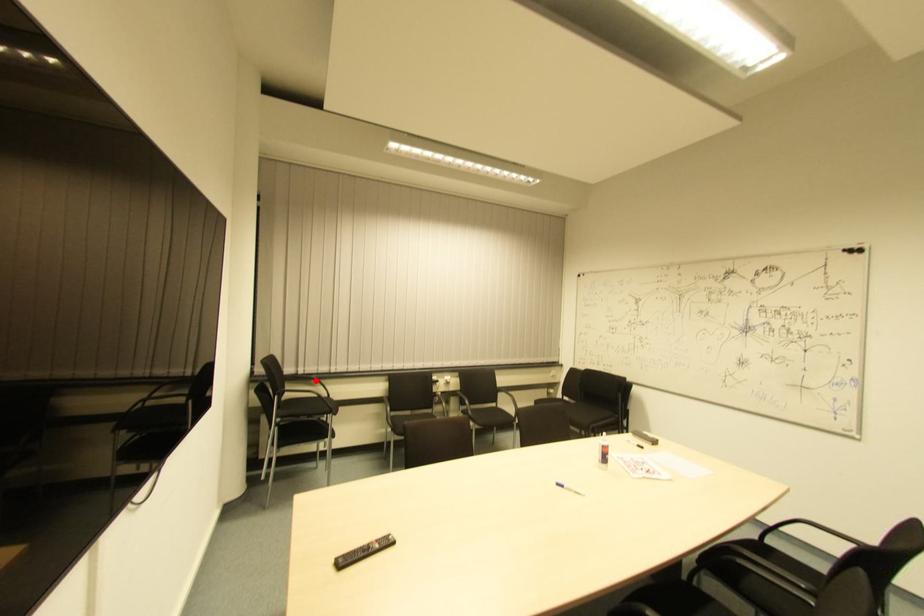
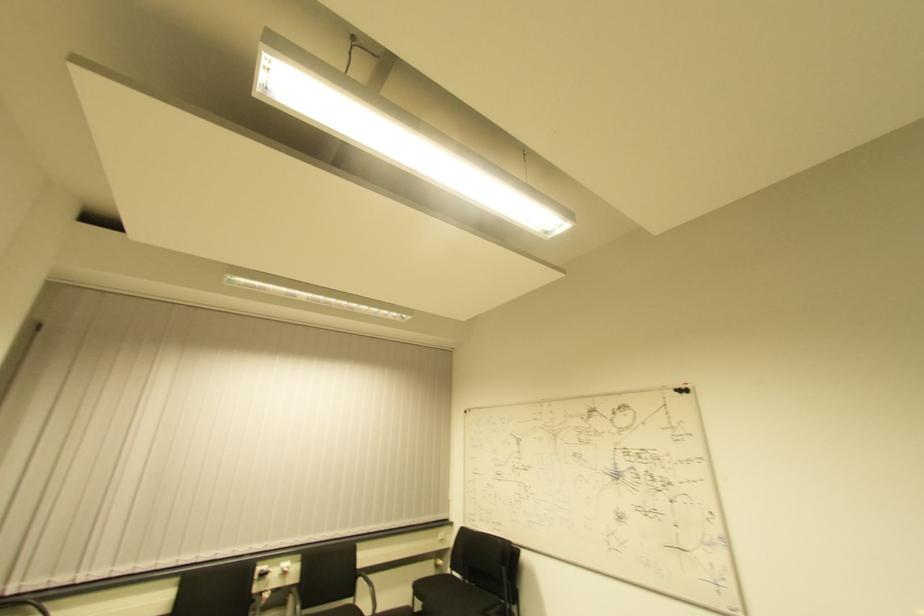
The point at the highlighted location is marked in the first image. Where is the corresponding point in the second image?

(37, 601)